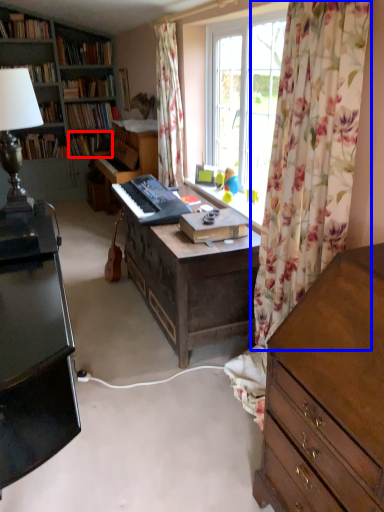
Question: Which of the following is the closest to the observer, book (highlighted by a red box) or curtain (highlighted by a blue box)?

Choices:
 (A) book
 (B) curtain

Answer: (B)